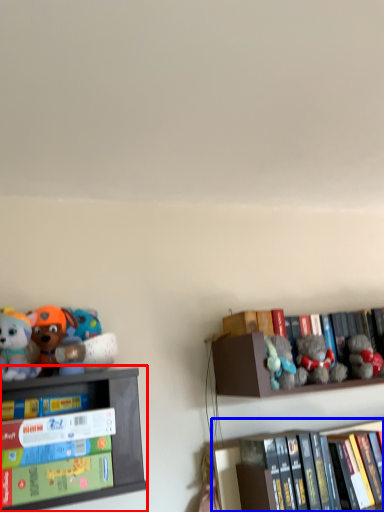
Question: Which of the following is the farthest to the observer, shelf (highlighted by a red box) or shelf (highlighted by a blue box)?

Choices:
 (A) shelf
 (B) shelf

Answer: (B)